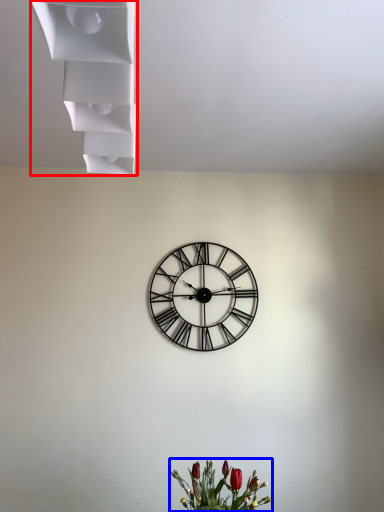
Question: Which point is further to the camera, shelf (highlighted by a red box) or floral arrangement (highlighted by a blue box)?

Choices:
 (A) shelf
 (B) floral arrangement

Answer: (B)